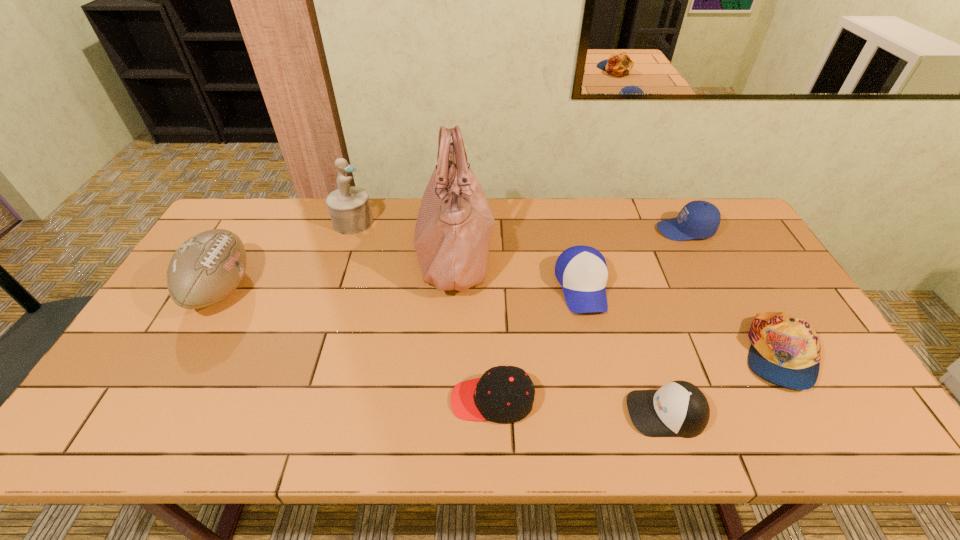
Where is `vacant space located on the front panel of the second cap from left to right`? The image size is (960, 540). vacant space located on the front panel of the second cap from left to right is located at coordinates (571, 413).

Locate an element on the screen. The image size is (960, 540). vacant space situated 0.200m on the front panel of the second cap from left to right is located at coordinates (540, 413).

Where is `handbag that is at the far edge`? handbag that is at the far edge is located at coordinates (454, 226).

I want to click on figurine that is at the far edge, so (349, 207).

At what (x,y) coordinates should I click in order to perform the action: click on cap that is at the far edge. Please return your answer as a coordinate pair (x, y). Looking at the image, I should click on (698, 219).

Identify the location of object that is at the left edge. (209, 266).

This screenshot has height=540, width=960. I want to click on object that is at the far right corner, so click(698, 219).

The image size is (960, 540). In the image, there is a desktop. Identify the location of vacant region at the far edge. (617, 205).

Find the location of `free region at the near edge`. free region at the near edge is located at coordinates (564, 415).

At what (x,y) coordinates should I click in order to perform the action: click on free space at the left edge of the desktop. Please return your answer as a coordinate pair (x, y). The width and height of the screenshot is (960, 540). Looking at the image, I should click on (174, 319).